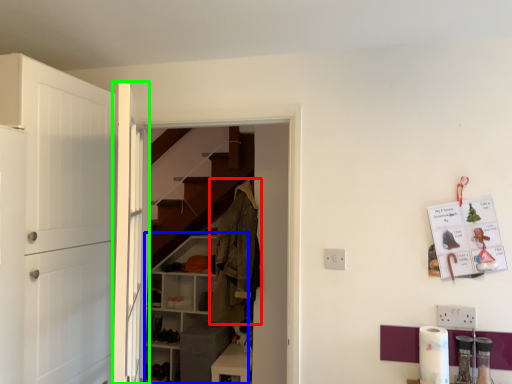
Question: Which is nearer to the clothing (highlighted by a red box)? cabinetry (highlighted by a blue box) or door (highlighted by a green box).

Choices:
 (A) cabinetry
 (B) door

Answer: (A)